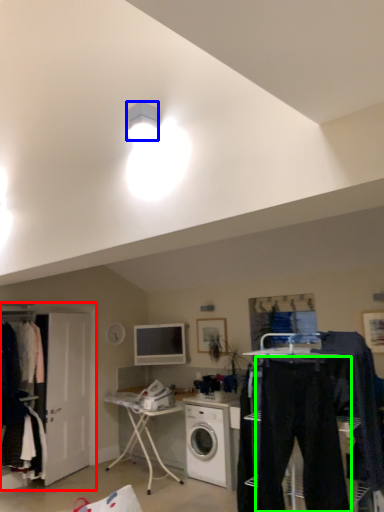
Question: Considering the real-world distances, which object is closest to closet (highlighted by a red box)? lamp (highlighted by a blue box) or trousers (highlighted by a green box).

Choices:
 (A) lamp
 (B) trousers

Answer: (B)